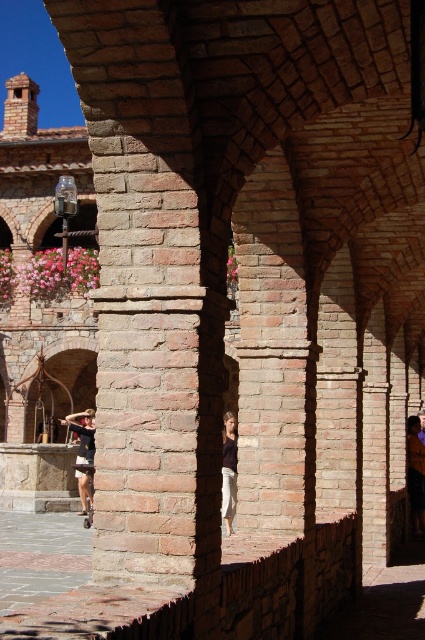
Question: From the image, what is the correct spatial relationship of brick archway at center in relation to dark brown leather jacket at lower left?

Choices:
 (A) above
 (B) below

Answer: (A)

Question: Which object is positioned farthest from the dark brown leather jacket at lower left?

Choices:
 (A) white cotton pants at center
 (B) brick archway at center
 (C) dark blue jeans at center

Answer: (C)

Question: Is white cotton pants at center smaller than dark brown leather jacket at lower left?

Choices:
 (A) yes
 (B) no

Answer: (A)

Question: Does brick archway at center appear under dark brown leather jacket at lower left?

Choices:
 (A) yes
 (B) no

Answer: (B)

Question: Which of the following is the closest to the observer?

Choices:
 (A) brick archway at center
 (B) dark brown leather jacket at lower left

Answer: (B)

Question: Considering the real-world distances, which object is closest to the dark blue jeans at center?

Choices:
 (A) brick archway at center
 (B) white cotton pants at center
 (C) dark brown leather jacket at lower left

Answer: (B)